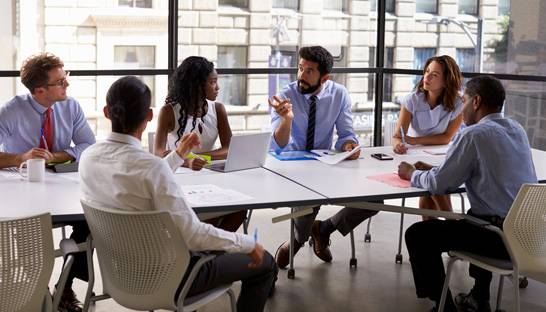
Where is `chairs`? chairs is located at coordinates [22, 264], [129, 257], [531, 237], [290, 228], [401, 230], [63, 230].